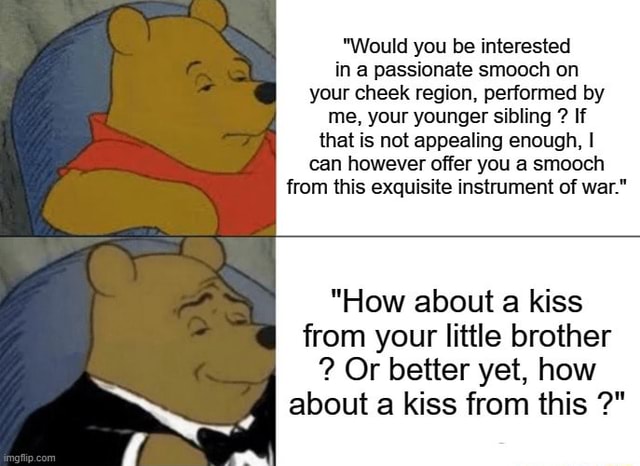
You are a GUI agent. You are given a task and a screenshot of the screen. Output one action in this format:
    pyautogui.click(x=<x>, y=<y>)
    Task: Click on the wall
    Image resolution: width=640 pixels, height=466 pixels.
    Given the screenshot: What is the action you would take?
    pyautogui.click(x=16, y=44)